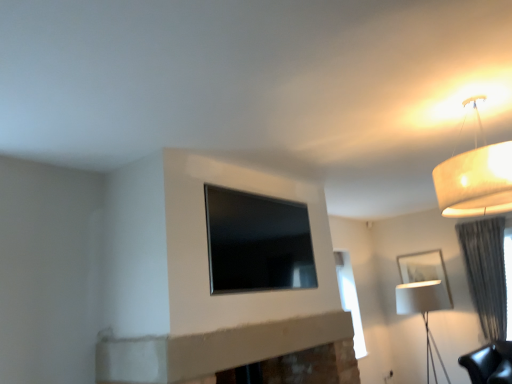
Question: Is the depth of black glass window at center less than that of white matte picture frame at right?

Choices:
 (A) yes
 (B) no

Answer: (A)

Question: Is black glass window at center positioned beyond the bounds of white matte picture frame at right?

Choices:
 (A) yes
 (B) no

Answer: (A)

Question: Is black glass window at center turned away from white matte picture frame at right?

Choices:
 (A) yes
 (B) no

Answer: (B)

Question: Does black glass window at center have a smaller size compared to white matte picture frame at right?

Choices:
 (A) yes
 (B) no

Answer: (B)

Question: From a real-world perspective, is black glass window at center located higher than white matte picture frame at right?

Choices:
 (A) yes
 (B) no

Answer: (A)

Question: Is black glass window at center placed right next to white matte picture frame at right?

Choices:
 (A) yes
 (B) no

Answer: (B)

Question: From the image's perspective, is white fabric lampshade at right, the first lamp viewed from the back, located beneath gray textured curtain at right?

Choices:
 (A) no
 (B) yes

Answer: (B)

Question: Is gray textured curtain at right inside white fabric lampshade at right, placed as the 1th lamp when sorted from right to left?

Choices:
 (A) yes
 (B) no

Answer: (B)

Question: Is white fabric lampshade at right, placed as the 2th lamp when sorted from front to back, positioned before gray textured curtain at right?

Choices:
 (A) no
 (B) yes

Answer: (B)

Question: Is white fabric lampshade at right, placed as the 1th lamp when sorted from right to left, directly adjacent to gray textured curtain at right?

Choices:
 (A) yes
 (B) no

Answer: (B)

Question: Is white fabric lampshade at right, placed as the second lamp when sorted from top to bottom, turned away from gray textured curtain at right?

Choices:
 (A) no
 (B) yes

Answer: (A)

Question: Does white fabric lampshade at right, placed as the second lamp when sorted from top to bottom, appear on the left side of gray textured curtain at right?

Choices:
 (A) yes
 (B) no

Answer: (A)

Question: Is white matte picture frame at right positioned behind gray textured curtain at right?

Choices:
 (A) yes
 (B) no

Answer: (A)